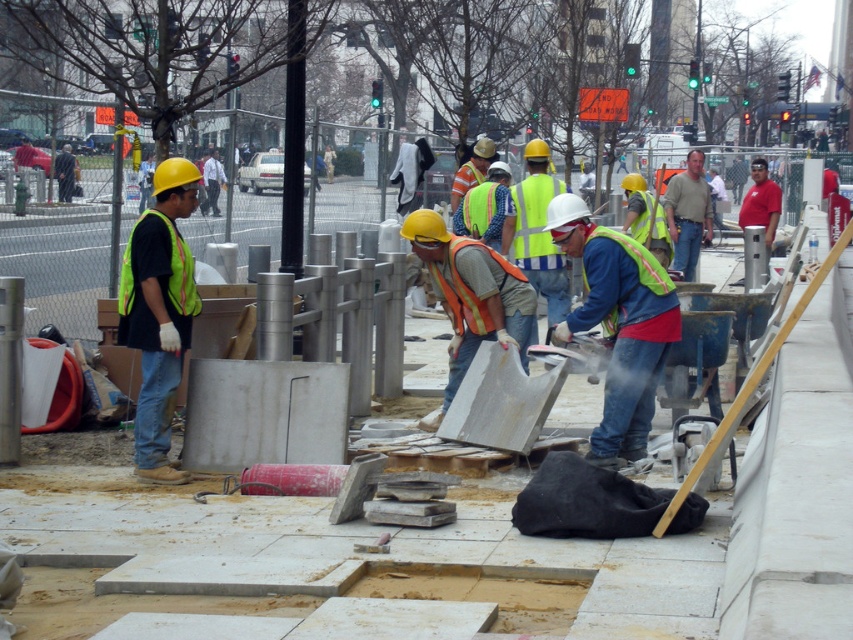
You are a safety inspector at the construction site. You notice two items on the ground near the workers. One is the matte yellow hard hat at left and the other is the reflective yellow safety vest at center. Which item is bigger in size?

The matte yellow hard hat at left has a larger size compared to the reflective yellow safety vest at center, so the matte yellow hard hat at left is bigger.